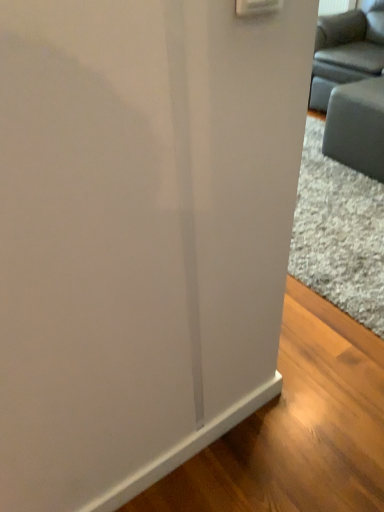
Question: Does matte gray couch at upper right have a lesser width compared to gray fabric couch at right?

Choices:
 (A) no
 (B) yes

Answer: (A)

Question: Does matte gray couch at upper right lie in front of gray fabric couch at right?

Choices:
 (A) no
 (B) yes

Answer: (A)

Question: Can you confirm if matte gray couch at upper right is wider than gray fabric couch at right?

Choices:
 (A) yes
 (B) no

Answer: (A)

Question: Is matte gray couch at upper right aimed at gray fabric couch at right?

Choices:
 (A) yes
 (B) no

Answer: (B)

Question: Is matte gray couch at upper right at the left side of gray fabric couch at right?

Choices:
 (A) yes
 (B) no

Answer: (B)

Question: Can you confirm if matte gray couch at upper right is bigger than gray fabric couch at right?

Choices:
 (A) no
 (B) yes

Answer: (B)

Question: Can you confirm if gray fabric couch at right is positioned to the right of matte gray couch at upper right?

Choices:
 (A) no
 (B) yes

Answer: (A)

Question: Does gray fabric couch at right have a lesser height compared to matte gray couch at upper right?

Choices:
 (A) yes
 (B) no

Answer: (A)

Question: Is gray fabric couch at right positioned in front of matte gray couch at upper right?

Choices:
 (A) yes
 (B) no

Answer: (A)

Question: Is the position of gray fabric couch at right more distant than that of matte gray couch at upper right?

Choices:
 (A) no
 (B) yes

Answer: (A)

Question: From a real-world perspective, does gray fabric couch at right sit lower than matte gray couch at upper right?

Choices:
 (A) no
 (B) yes

Answer: (B)

Question: Considering the relative sizes of gray fabric couch at right and matte gray couch at upper right in the image provided, is gray fabric couch at right smaller than matte gray couch at upper right?

Choices:
 (A) no
 (B) yes

Answer: (B)

Question: From a real-world perspective, is matte gray couch at upper right positioned above or below gray fabric couch at right?

Choices:
 (A) above
 (B) below

Answer: (A)